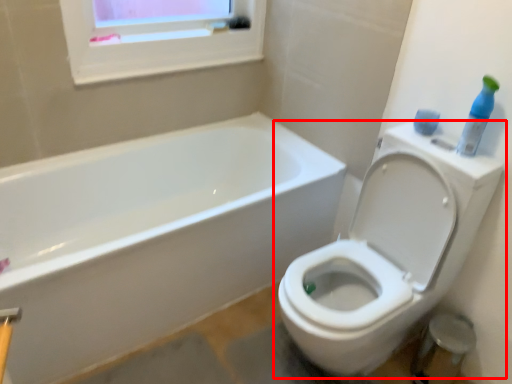
Question: From the image's perspective, where is toilet (annotated by the red box) located in relation to cleaning product in the image?

Choices:
 (A) above
 (B) below

Answer: (B)